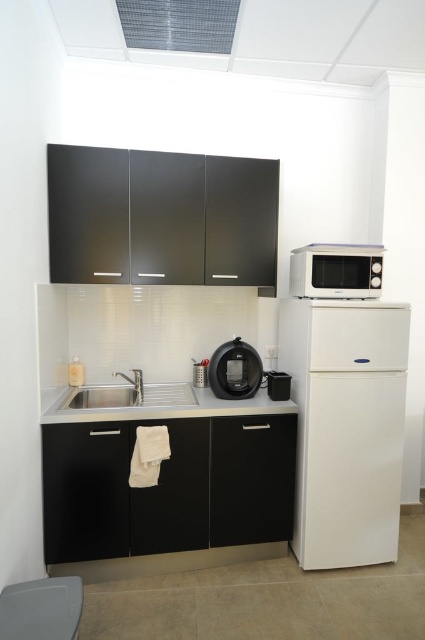
You are standing in the kitchenette and need to reach the white matte refrigerator at right. Based on the layout, where would you expect it to be located relative to the sink?

The white matte refrigerator at right is located at the position corresponding to the coordinate point 0.667 on the x axis and 0.814 on the y axis, so it is positioned to the right side of the kitchenette area, likely near the back wall since the x coordinate is 0.667 which is two thirds of the way from the left edge, and the y coordinate 0.814 is close to the bottom edge, meaning it is placed lower in the image. Therefore, relative to the sink on the left, the refrigerator is to the right and slightly back

You are a barista preparing drinks and need to move the satin black coffee maker at center to the right side of the stainless steel sink at lower center. Is this possible given their current positions?

The stainless steel sink at lower center is positioned on the left side of the satin black coffee maker at center, so moving the coffee maker to the right of the sink would require shifting it further to the right, which may be possible if there is enough space on the counter. However, based on the provided information, we can only confirm their relative positions, not the available space for movement.